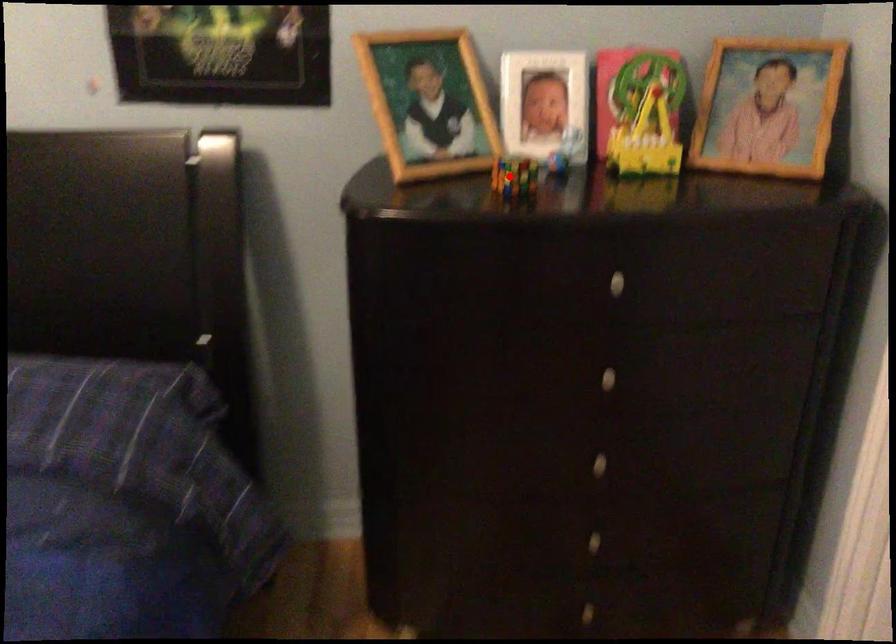
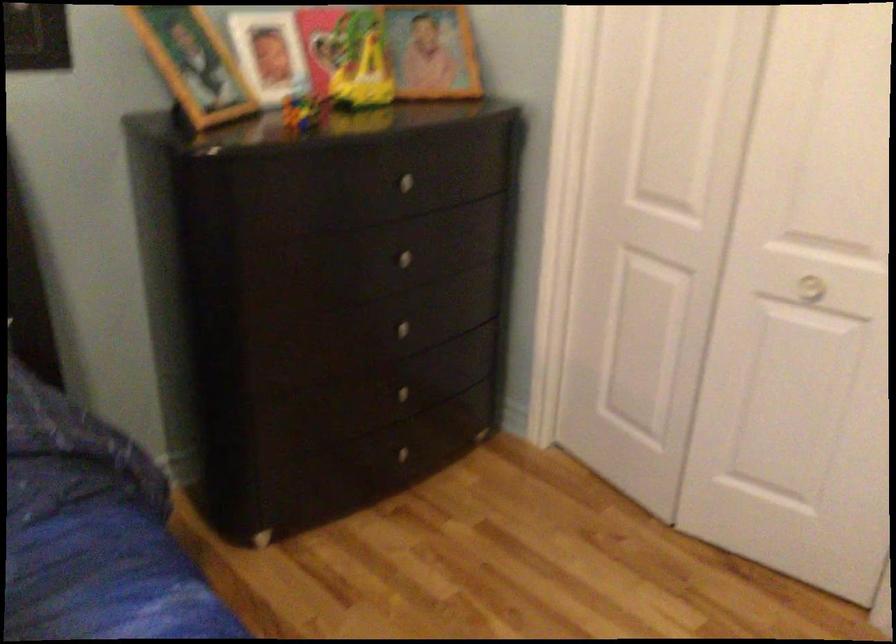
Where in the second image is the point corresponding to the highlighted location from the first image?

(303, 111)